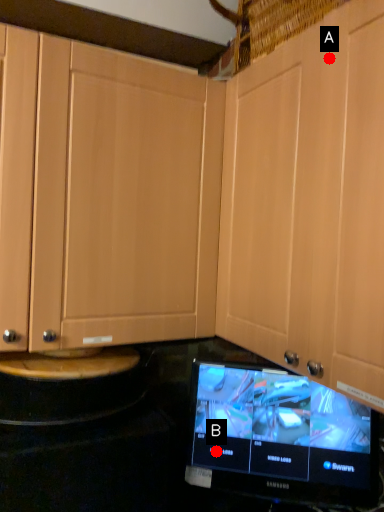
Question: Two points are circled on the image, labeled by A and B beside each circle. Which point is closer to the camera taking this photo?

Choices:
 (A) A is closer
 (B) B is closer

Answer: (A)